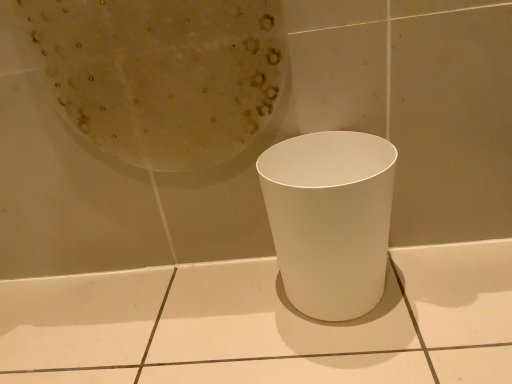
You are a GUI agent. You are given a task and a screenshot of the screen. Output one action in this format:
    pyautogui.click(x=<x>, y=<y>)
    Task: Click on the free point to the right of white matte waste container at center
    This screenshot has width=512, height=384.
    Given the screenshot: What is the action you would take?
    pyautogui.click(x=446, y=286)